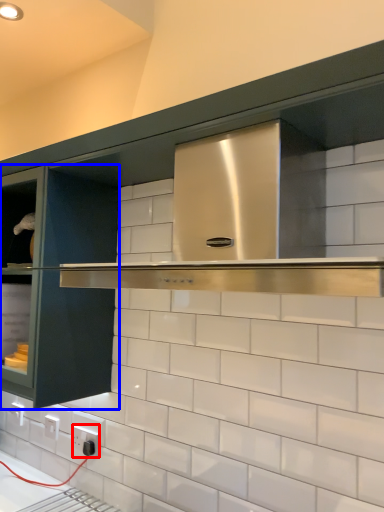
Question: Among these objects, which one is farthest to the camera, electric outlet (highlighted by a red box) or glass door (highlighted by a blue box)?

Choices:
 (A) electric outlet
 (B) glass door

Answer: (A)